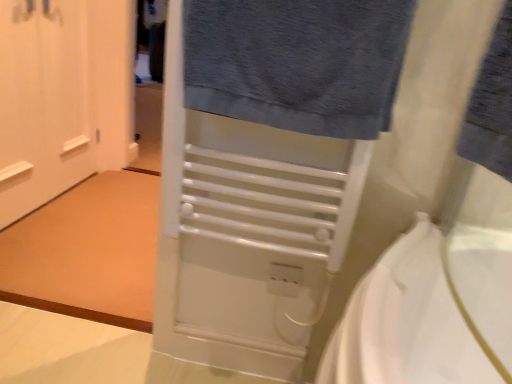
Question: From the image's perspective, is dark gray textured towel at upper center on blue cotton towel at upper right?

Choices:
 (A) yes
 (B) no

Answer: (A)

Question: From the image's perspective, does dark gray textured towel at upper center appear lower than blue cotton towel at upper right?

Choices:
 (A) yes
 (B) no

Answer: (B)

Question: From a real-world perspective, is dark gray textured towel at upper center under blue cotton towel at upper right?

Choices:
 (A) no
 (B) yes

Answer: (B)

Question: Considering the relative sizes of dark gray textured towel at upper center and blue cotton towel at upper right in the image provided, is dark gray textured towel at upper center shorter than blue cotton towel at upper right?

Choices:
 (A) no
 (B) yes

Answer: (A)

Question: Can you confirm if dark gray textured towel at upper center is positioned to the right of blue cotton towel at upper right?

Choices:
 (A) no
 (B) yes

Answer: (A)

Question: Are dark gray textured towel at upper center and blue cotton towel at upper right far apart?

Choices:
 (A) yes
 (B) no

Answer: (B)

Question: Does blue cotton towel at upper right appear on the right side of white plastic electric outlet at center?

Choices:
 (A) no
 (B) yes

Answer: (B)

Question: Is blue cotton towel at upper right positioned before white plastic electric outlet at center?

Choices:
 (A) no
 (B) yes

Answer: (B)

Question: Is blue cotton towel at upper right not within white plastic electric outlet at center?

Choices:
 (A) yes
 (B) no

Answer: (A)

Question: Is blue cotton towel at upper right beside white plastic electric outlet at center?

Choices:
 (A) yes
 (B) no

Answer: (B)

Question: Is blue cotton towel at upper right thinner than white plastic electric outlet at center?

Choices:
 (A) yes
 (B) no

Answer: (B)

Question: Can you confirm if blue cotton towel at upper right is positioned to the left of white plastic electric outlet at center?

Choices:
 (A) no
 (B) yes

Answer: (A)

Question: Does white matte door at left contain white plastic electric outlet at center?

Choices:
 (A) yes
 (B) no

Answer: (B)